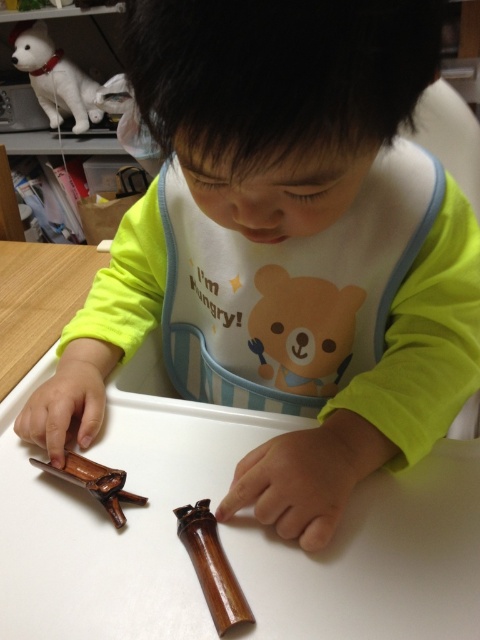
Is brown matte bear at center positioned before brown wooden stick at lower left?

No, it is behind brown wooden stick at lower left.

Describe the element at coordinates (302, 330) in the screenshot. The image size is (480, 640). I see `brown matte bear at center` at that location.

This screenshot has width=480, height=640. I want to click on brown matte bear at center, so click(302, 330).

Who is more forward, [216,630] or [105,492]?

Positioned in front is point [216,630].

The image size is (480, 640). What are the coordinates of `brown polished wooden stick at center` in the screenshot? It's located at (212, 566).

In the scene shown: Between brown wood table at center and brown wooden stick at lower left, which one has less height?

brown wooden stick at lower left

Measure the distance between point (376, 522) and camera.

Point (376, 522) and camera are 20.64 inches apart.

You are a GUI agent. You are given a task and a screenshot of the screen. Output one action in this format:
    pyautogui.click(x=<x>, y=<y>)
    Task: Click on the brown wood table at center
    Image resolution: width=480 pixels, height=640 pixels.
    Given the screenshot: What is the action you would take?
    pyautogui.click(x=126, y=512)